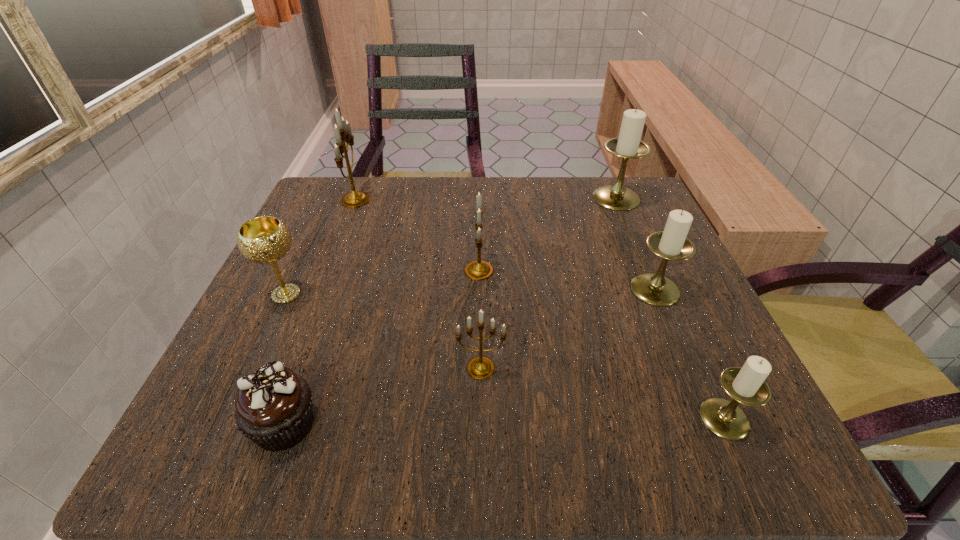
Locate an element on the screen. Image resolution: width=960 pixels, height=540 pixels. vacant region at the near edge of the desktop is located at coordinates (603, 409).

Locate an element on the screen. Image resolution: width=960 pixels, height=540 pixels. blank space at the left edge is located at coordinates (306, 246).

At what (x,y) coordinates should I click in order to perform the action: click on free space at the right edge. Please return your answer as a coordinate pair (x, y). Looking at the image, I should click on (613, 267).

This screenshot has width=960, height=540. In the image, there is a desktop. In order to click on vacant space at the far left corner in this screenshot , I will do `click(346, 228)`.

Where is `vacant region at the far right corner`? This screenshot has height=540, width=960. vacant region at the far right corner is located at coordinates (626, 236).

Find the location of `free space at the near right corner`. free space at the near right corner is located at coordinates (757, 418).

This screenshot has width=960, height=540. In order to click on vacant point located between the chalice and the nearest gold candelabrum in this screenshot , I will do `click(383, 331)`.

Locate an element on the screen. free point between the leftmost gold candelabrum and the nearest candle holder is located at coordinates (540, 309).

Where is `free area in between the second nearest white candle holder and the second farthest gold candelabrum`? free area in between the second nearest white candle holder and the second farthest gold candelabrum is located at coordinates (567, 280).

This screenshot has height=540, width=960. Identify the location of empty space between the farthest gold candelabrum and the chalice. (321, 247).